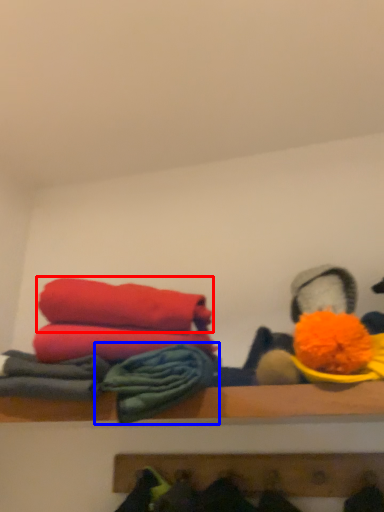
Question: Which point is further to the camera, towel (highlighted by a red box) or material (highlighted by a blue box)?

Choices:
 (A) towel
 (B) material

Answer: (A)